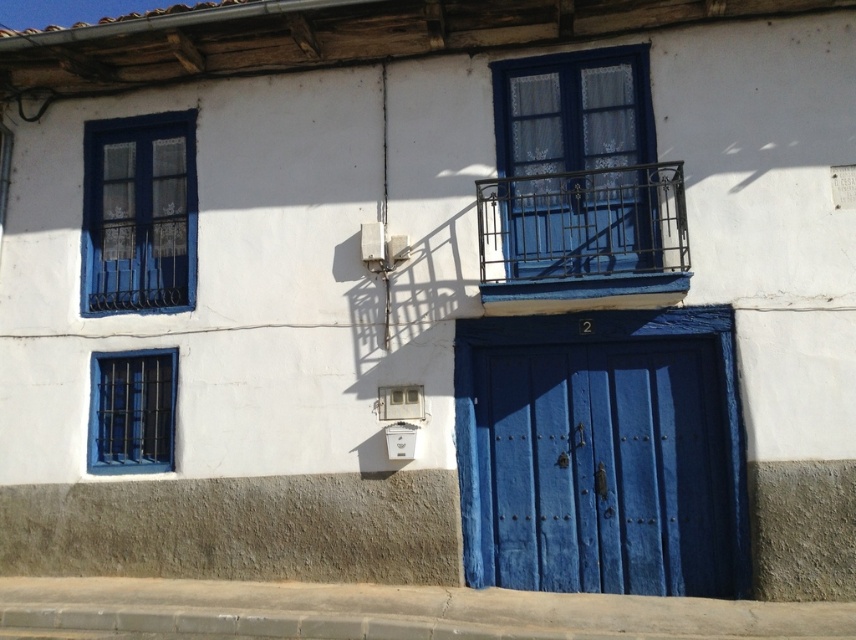
Question: Which of the following is the closest to the observer?

Choices:
 (A) matte blue window at upper left
 (B) blue wooden door at center
 (C) matte blue window at lower left
 (D) metallic blue balcony at center

Answer: (D)

Question: Is metallic blue balcony at center positioned behind matte blue window at lower left?

Choices:
 (A) no
 (B) yes

Answer: (A)

Question: Does matte blue window at upper left appear under matte blue window at lower left?

Choices:
 (A) no
 (B) yes

Answer: (A)

Question: Which point is closer to the camera taking this photo?

Choices:
 (A) (110, 353)
 (B) (165, 115)
 (C) (691, 358)
 (D) (524, 193)

Answer: (C)

Question: Considering the real-world distances, which object is closest to the matte blue window at upper left?

Choices:
 (A) matte blue window at lower left
 (B) blue wooden door at center
 (C) blue glass window at upper center
 (D) metallic blue balcony at center

Answer: (A)

Question: Considering the relative positions of blue wooden door at center and metallic blue balcony at center in the image provided, where is blue wooden door at center located with respect to metallic blue balcony at center?

Choices:
 (A) right
 (B) left

Answer: (A)